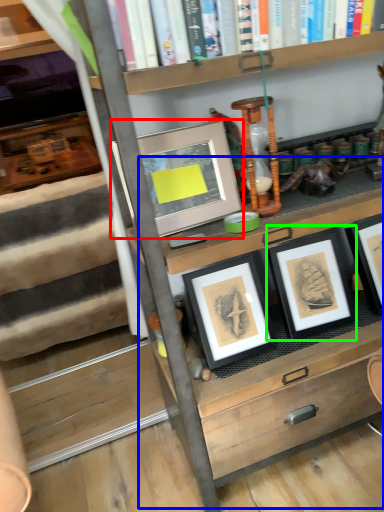
Question: Which object is the closest to the picture frame (highlighted by a red box)? Choose among these: table (highlighted by a blue box) or picture frame (highlighted by a green box).

Choices:
 (A) table
 (B) picture frame

Answer: (B)